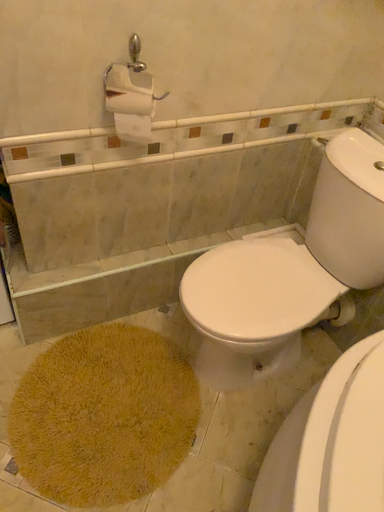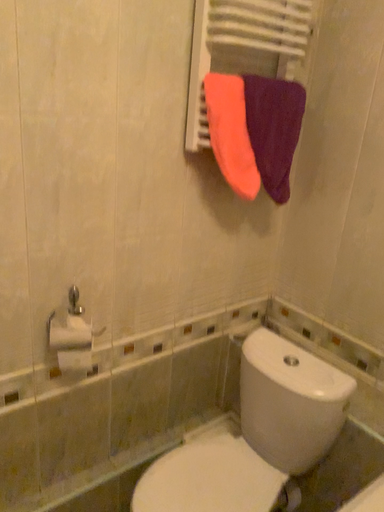
Question: Which way did the camera rotate in the video?

Choices:
 (A) rotated upward
 (B) rotated downward

Answer: (A)